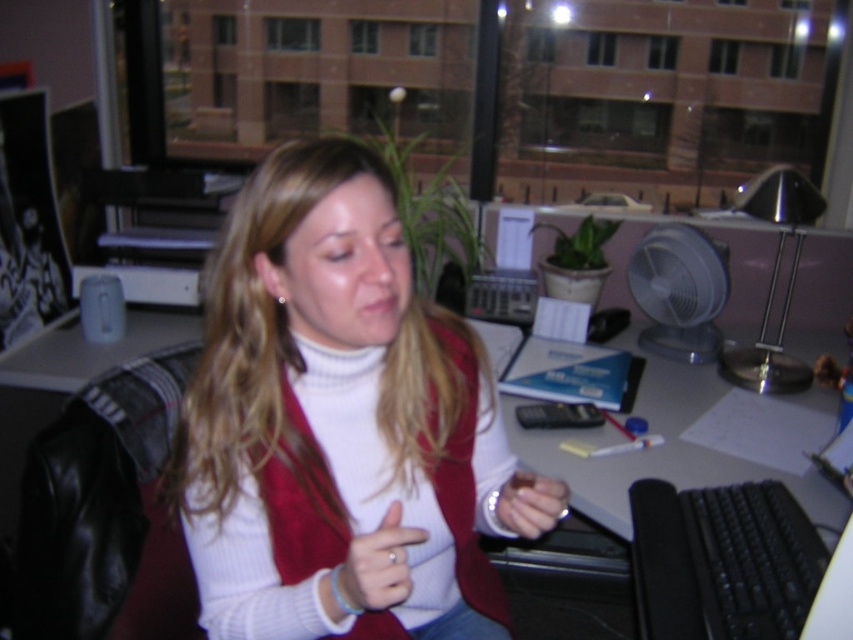
Question: From the image, what is the correct spatial relationship of clear plastic fan at right in relation to matte silver ring at center?

Choices:
 (A) right
 (B) left

Answer: (A)

Question: Which point is closer to the camera taking this photo?

Choices:
 (A) (537, 536)
 (B) (581, 580)

Answer: (A)

Question: Which object is the farthest from the matte silver ring at center?

Choices:
 (A) clear plastic fan at right
 (B) white soft sweater at center
 (C) matte white hand at center

Answer: (A)

Question: Can you confirm if black plastic keyboard at lower right is smaller than matte white hand at center?

Choices:
 (A) yes
 (B) no

Answer: (B)

Question: Does matte white hand at center lie behind matte silver ring at center?

Choices:
 (A) no
 (B) yes

Answer: (A)

Question: Which of these objects is positioned closest to the clear plastic fan at right?

Choices:
 (A) matte white hand at center
 (B) black plastic keyboard at lower right
 (C) matte silver ring at center
 (D) white soft sweater at center

Answer: (B)